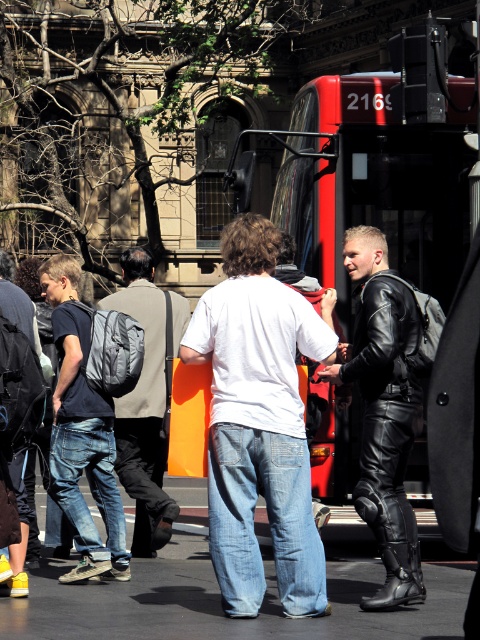
Does black asphalt at lower center have a larger size compared to black leather jacket at center?

No.

Between point (55, 584) and point (400, 362), which one is positioned behind?

Point (55, 584)

Is point (264, 522) farther from viewer compared to point (382, 429)?

Yes, point (264, 522) is behind point (382, 429).

Where is `black asphalt at lower center`? black asphalt at lower center is located at coordinates (218, 593).

Based on the photo, is the position of black asphalt at lower center less distant than that of denim jeans at left?

Yes.

Is point (61, 600) behind point (108, 467)?

No, it is in front of (108, 467).

Measure the distance between point (91, 636) and camera.

The distance of point (91, 636) from camera is 7.40 meters.

This screenshot has width=480, height=640. In order to click on black asphalt at lower center in this screenshot , I will do `click(218, 593)`.

You are a GUI agent. You are given a task and a screenshot of the screen. Output one action in this format:
    pyautogui.click(x=<x>, y=<y>)
    Task: Click on the white matte t-shirt at center
    The height and width of the screenshot is (640, 480).
    Given the screenshot: What is the action you would take?
    pyautogui.click(x=260, y=420)

Is point (271, 477) positioned before point (4, 632)?

That is False.

Find the location of a particular element. The height and width of the screenshot is (640, 480). white matte t-shirt at center is located at coordinates (260, 420).